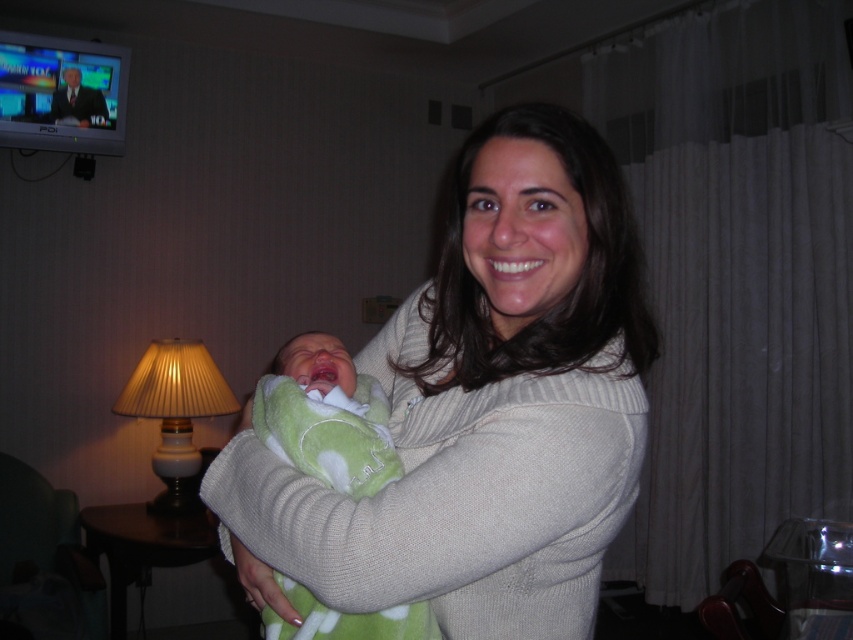
Consider the image. You are a photographer setting up a shoot in this room. You need to decide whether to place a 1.2m tall model between the white knit sweater at center and the matte beige lampshade at left. Based on their heights, will the model fit between them without being blocked?

The white knit sweater at center is not as tall as matte beige lampshade at left, so the sweater is shorter. The model is 1.2m tall, which is taller than both objects. Placing the model between them may block the view of both the sweater and the lampshade since the model is taller.

You are a photographer setting up a shoot in this room. You notice the white knit sweater at center and the green soft blanket at center. Which item should you adjust to ensure both are fully visible in the frame without moving the camera?

Since the white knit sweater at center is larger in size than the green soft blanket at center, you should adjust the white knit sweater at center to ensure both are fully visible in the frame without moving the camera.